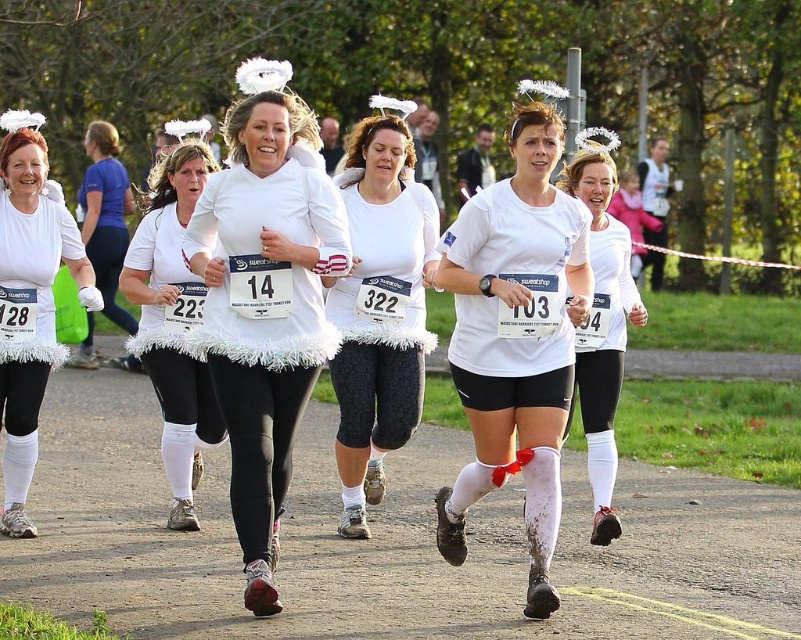
You are a photographer at the charity run event. You need to capture a photo that includes both the white fabric leggings at center and the white textured fabric at center. Which object should you focus on to ensure both are in the frame without cropping?

The white fabric leggings at center is smaller than the white textured fabric at center, so focusing on the larger white textured fabric at center will help ensure both objects are in the frame without cropping.